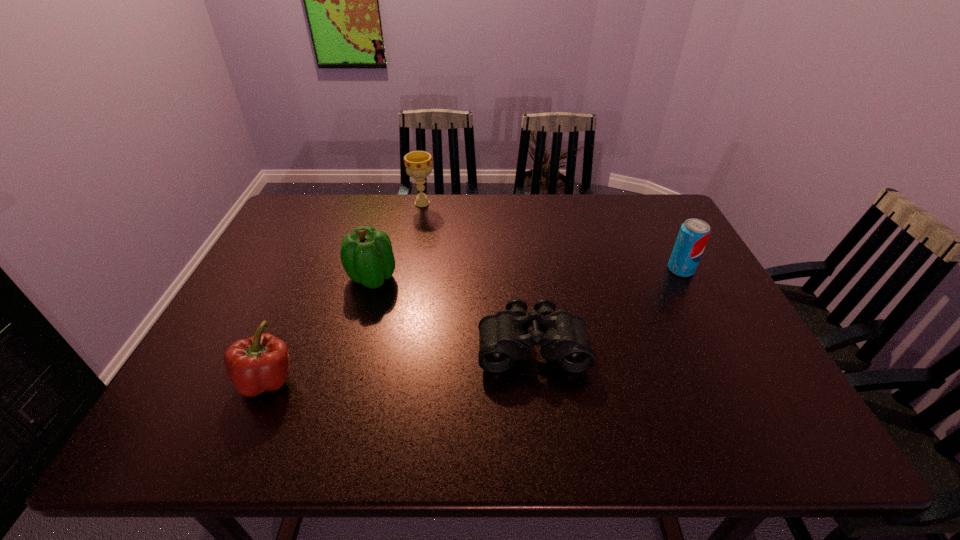
This screenshot has height=540, width=960. Find the location of `vacant space located 0.110m on the front of the rightmost object`. vacant space located 0.110m on the front of the rightmost object is located at coordinates (701, 306).

Locate an element on the screen. This screenshot has height=540, width=960. vacant space located 0.170m on the back of the fourth tallest object is located at coordinates (300, 303).

In order to click on vacant region located at the eyepieces of the binoculars in this screenshot , I will do `click(540, 409)`.

You are a GUI agent. You are given a task and a screenshot of the screen. Output one action in this format:
    pyautogui.click(x=<x>, y=<y>)
    Task: Click on the object positioned at the far edge
    
    Given the screenshot: What is the action you would take?
    pyautogui.click(x=418, y=164)

Identify the location of object that is positioned at the left edge. The image size is (960, 540). (261, 363).

At what (x,y) coordinates should I click in order to perform the action: click on object located at the right edge. Please return your answer as a coordinate pair (x, y). The width and height of the screenshot is (960, 540). Looking at the image, I should click on (694, 233).

Locate an element on the screen. This screenshot has width=960, height=540. blank space at the far edge of the desktop is located at coordinates (347, 218).

In the image, there is a desktop. In order to click on vacant space at the left edge in this screenshot , I will do `click(255, 301)`.

At what (x,y) coordinates should I click in order to perform the action: click on blank space at the right edge of the desktop. Please return your answer as a coordinate pair (x, y). The height and width of the screenshot is (540, 960). Looking at the image, I should click on (716, 366).

Locate an element on the screen. The width and height of the screenshot is (960, 540). free space at the far left corner of the desktop is located at coordinates (300, 205).